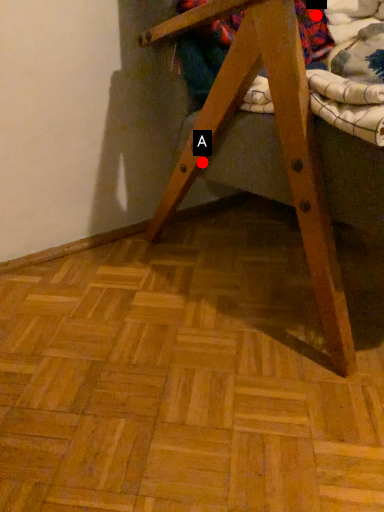
Question: Two points are circled on the image, labeled by A and B beside each circle. Which of the following is the closest to the observer?

Choices:
 (A) A is closer
 (B) B is closer

Answer: (A)